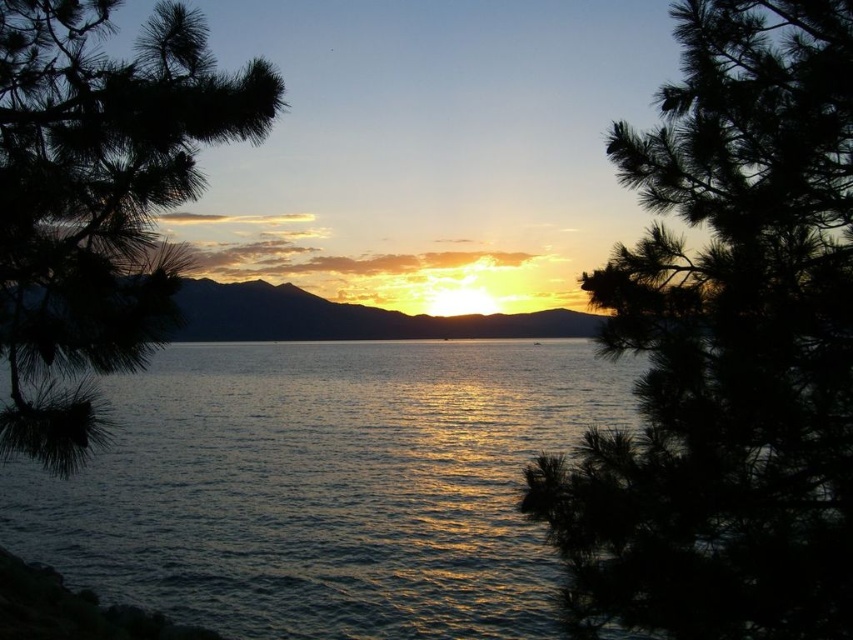
You are standing at the edge of the lake and notice the dark green pine tree at center and the glistening silver water at center. Which object appears taller in the scene?

The glistening silver water at center appears taller than the dark green pine tree at center according to the description.

You are an artist trying to paint the sunset scene. You notice the glistening silver water at center and the green matte pine branch at left. Which object in the scene has a greater width?

The glistening silver water at center has a greater width than the green matte pine branch at left according to the description.

You are standing at the edge of the lake and see the point marked at coordinates (325, 486). Based on the scene description, what does this point represent?

The point at coordinates (325, 486) marks the glistening silver water at center.